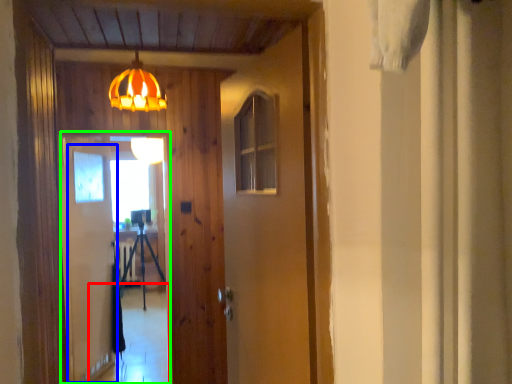
Question: Based on their relative distances, which object is farther from corridor (highlighted by a red box)? Choose from screen door (highlighted by a blue box) and screen door (highlighted by a green box).

Choices:
 (A) screen door
 (B) screen door

Answer: (A)